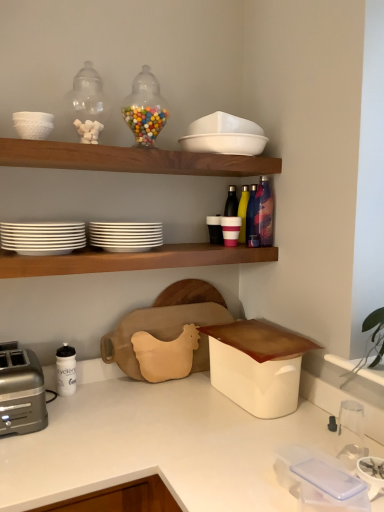
This screenshot has width=384, height=512. I want to click on white glossy plates at upper left, positioned as the second tableware in bottom-to-top order, so click(42, 237).

Locate an element on the screen. This screenshot has height=512, width=384. matte black cup at center, the third tableware positioned from the top is located at coordinates (215, 229).

This screenshot has height=512, width=384. I want to click on metallic multi-colored bottle at upper right, the 1th bottle viewed from the front, so click(x=264, y=213).

This screenshot has height=512, width=384. What are the coordinates of `white glossy plates at upper left, positioned as the second tableware in bottom-to-top order` in the screenshot? It's located at (42, 237).

Is point (251, 160) closer or farther from the camera than point (254, 232)?

Point (251, 160) is positioned closer to the camera compared to point (254, 232).

Is wooden shelf at upper center, acting as the first shelf starting from the top, inside the boundaries of metallic blue water bottle at upper right, the 2th bottle when ordered from back to front, or outside?

wooden shelf at upper center, acting as the first shelf starting from the top, cannot be found inside metallic blue water bottle at upper right, the 2th bottle when ordered from back to front.

Is the depth of wooden shelf at upper center, acting as the first shelf starting from the top, greater than that of metallic blue water bottle at upper right, the second bottle in the front-to-back sequence?

No, wooden shelf at upper center, acting as the first shelf starting from the top, is closer to the camera.

From a real-world perspective, does white glossy plates at upper left, positioned as the second tableware in bottom-to-top order, sit lower than metallic multi-colored bottle at upper right, the 1th bottle viewed from the front?

Correct, in the physical world, white glossy plates at upper left, positioned as the second tableware in bottom-to-top order, is lower than metallic multi-colored bottle at upper right, the 1th bottle viewed from the front.

Is metallic multi-colored bottle at upper right, the 1th bottle viewed from the front, at the back of white glossy plates at upper left, positioned as the second tableware in bottom-to-top order?

No.

Is white glossy plates at upper left, the 6th tableware from the top, smaller than metallic multi-colored bottle at upper right, arranged as the third bottle when viewed from the back?

Actually, white glossy plates at upper left, the 6th tableware from the top, might be larger than metallic multi-colored bottle at upper right, arranged as the third bottle when viewed from the back.

Considering the positions of point (74, 222) and point (256, 223), is point (74, 222) closer or farther from the camera than point (256, 223)?

Point (74, 222) appears to be closer to the viewer than point (256, 223).

From the image's perspective, relative to matte black cup at center, the 5th tableware in the bottom-to-top sequence, is metallic multi-colored bottle at upper right, arranged as the third bottle when viewed from the back, above or below?

Clearly, from the image's perspective, metallic multi-colored bottle at upper right, arranged as the third bottle when viewed from the back, is above matte black cup at center, the 5th tableware in the bottom-to-top sequence.

How many degrees apart are the facing directions of metallic multi-colored bottle at upper right, the 1th bottle viewed from the front, and matte black cup at center, the third tableware positioned from the top?

0.00116 degrees.

Is metallic multi-colored bottle at upper right, arranged as the third bottle when viewed from the back, facing towards matte black cup at center, the third tableware positioned from the top?

No.

Is metallic multi-colored bottle at upper right, the 1th bottle viewed from the front, to the left of matte black cup at center, the third tableware positioned from the top, from the viewer's perspective?

Incorrect, metallic multi-colored bottle at upper right, the 1th bottle viewed from the front, is not on the left side of matte black cup at center, the third tableware positioned from the top.

From a real-world perspective, who is located lower, white matte plates at center, the 2th shelf from the top, or white matte cup at center, the fourth tableware positioned from the bottom?

In real-world perspective, white matte plates at center, the 2th shelf from the top, is lower.

Between white matte plates at center, the first shelf ordered from the bottom, and white matte cup at center, which appears as the fourth tableware when viewed from the top, which one has smaller size?

With smaller size is white matte cup at center, which appears as the fourth tableware when viewed from the top.

Identify the location of shelf that is the 1st one when counting leftward from the white matte cup at center, which appears as the fourth tableware when viewed from the top. The width and height of the screenshot is (384, 512). (132, 259).

Which is in front, white matte plates at center, the 2th shelf from the top, or white matte cup at center, which appears as the fourth tableware when viewed from the top?

white matte plates at center, the 2th shelf from the top, is closer to the camera.

Consider the image. From the image's perspective, relative to wooden shelf at upper center, the second shelf when ordered from bottom to top, is yellow matte bottle at upper right, which ranks as the third bottle in front-to-back order, above or below?

Clearly, from the image's perspective, yellow matte bottle at upper right, which ranks as the third bottle in front-to-back order, is below wooden shelf at upper center, the second shelf when ordered from bottom to top.

From a real-world perspective, which object stands above the other?

In real-world perspective, wooden shelf at upper center, the second shelf when ordered from bottom to top, is above.

Which of these two, yellow matte bottle at upper right, which ranks as the third bottle in front-to-back order, or wooden shelf at upper center, the second shelf when ordered from bottom to top, is wider?

A: wooden shelf at upper center, the second shelf when ordered from bottom to top.

Is point (61, 371) positioned after point (195, 247)?

No, it is not.

Which object is wider, white matte water bottle at left, placed as the 1th tableware when sorted from bottom to top, or white matte plates at center, the first shelf ordered from the bottom?

Wider between the two is white matte plates at center, the first shelf ordered from the bottom.

In the scene shown: From the image's perspective, is white matte water bottle at left, which ranks as the 7th tableware in top-to-bottom order, on top of white matte plates at center, the 2th shelf from the top?

No.

Is white matte water bottle at left, placed as the 1th tableware when sorted from bottom to top, situated inside white matte plates at center, the 2th shelf from the top, or outside?

white matte water bottle at left, placed as the 1th tableware when sorted from bottom to top, is spatially situated outside white matte plates at center, the 2th shelf from the top.

Looking at their sizes, would you say metallic multi-colored bottle at upper right, the 1th bottle viewed from the front, is wider or thinner than white matte cup at center, the fourth tableware positioned from the bottom?

metallic multi-colored bottle at upper right, the 1th bottle viewed from the front, is wider than white matte cup at center, the fourth tableware positioned from the bottom.

Which is closer to the camera, (256, 212) or (236, 229)?

Point (256, 212) is closer to the camera than point (236, 229).

Considering their positions, is metallic multi-colored bottle at upper right, arranged as the third bottle when viewed from the back, located in front of or behind white matte cup at center, the fourth tableware positioned from the bottom?

Visually, metallic multi-colored bottle at upper right, arranged as the third bottle when viewed from the back, is located in front of white matte cup at center, the fourth tableware positioned from the bottom.

Locate an element on the screen. The height and width of the screenshot is (512, 384). shelf above the metallic blue water bottle at upper right, the 2th bottle when ordered from back to front (from the image's perspective) is located at coordinates (131, 159).

Which tableware is the 5th one when counting from the front of the metallic multi-colored bottle at upper right, the 1th bottle viewed from the front? Please provide its 2D coordinates.

[(42, 237)]

Estimate the real-world distances between objects in this image. Which object is further from white matte bowl at upper left, the 2th tableware positioned from the top, white matte water bottle at left, which ranks as the 7th tableware in top-to-bottom order, or translucent glass jar at upper center, which is the seventh tableware in bottom-to-top order?

white matte water bottle at left, which ranks as the 7th tableware in top-to-bottom order, is positioned further to the anchor white matte bowl at upper left, the 2th tableware positioned from the top.

Which object lies further to the anchor point metallic blue water bottle at upper right, the second bottle in the front-to-back sequence, matte black cup at center, the third tableware positioned from the top, or wooden shelf at upper center, the second shelf when ordered from bottom to top?

The object further to metallic blue water bottle at upper right, the second bottle in the front-to-back sequence, is wooden shelf at upper center, the second shelf when ordered from bottom to top.

Considering their positions, is silver metallic toaster at lower left positioned closer to white matte plates at center, the first shelf ordered from the bottom, than metallic blue water bottle at upper right, the second bottle in the front-to-back sequence?

metallic blue water bottle at upper right, the second bottle in the front-to-back sequence, lies closer to white matte plates at center, the first shelf ordered from the bottom, than the other object.

From the image, which object appears to be nearer to metallic blue water bottle at upper right, the 2th bottle when ordered from back to front, white matte countertop at lower right or white glossy plates at upper center, which is the third tableware from bottom to top?

The object closer to metallic blue water bottle at upper right, the 2th bottle when ordered from back to front, is white glossy plates at upper center, which is the third tableware from bottom to top.

Considering their positions, is white glossy plates at upper left, positioned as the second tableware in bottom-to-top order, positioned further to matte black cup at center, the third tableware positioned from the top, than white glossy plates at upper center, which is the third tableware from bottom to top?

white glossy plates at upper left, positioned as the second tableware in bottom-to-top order.

Looking at the image, which one is located further to matte black cup at center, the 5th tableware in the bottom-to-top sequence, silver metallic toaster at lower left or white matte bowl at upper left, placed as the 6th tableware when sorted from bottom to top?

Among the two, silver metallic toaster at lower left is located further to matte black cup at center, the 5th tableware in the bottom-to-top sequence.

Which object lies further to the anchor point matte black cup at center, the third tableware positioned from the top, silver metallic toaster at lower left or yellow matte bottle at upper right, which ranks as the third bottle in front-to-back order?

silver metallic toaster at lower left is further to matte black cup at center, the third tableware positioned from the top.

Based on their spatial positions, is metallic blue water bottle at upper right, the 2th bottle when ordered from back to front, or matte black cup at center, the third tableware positioned from the top, further from white matte bowl at upper left, the 2th tableware positioned from the top?

Among the two, metallic blue water bottle at upper right, the 2th bottle when ordered from back to front, is located further to white matte bowl at upper left, the 2th tableware positioned from the top.

You are a GUI agent. You are given a task and a screenshot of the screen. Output one action in this format:
    pyautogui.click(x=<x>, y=<y>)
    Task: Click on the plant that lies between metallic multi-colored bottle at upper right, the 1th bottle viewed from the front, and white plastic container at lower right from top to bottom
    This screenshot has width=384, height=512.
    Given the screenshot: What is the action you would take?
    pyautogui.click(x=372, y=341)

At what (x,y) coordinates should I click in order to perform the action: click on appliance located between white glossy plates at upper left, positioned as the second tableware in bottom-to-top order, and green leafy plant at upper right in the left-right direction. Please return your answer as a coordinate pair (x, y). Looking at the image, I should click on (257, 365).

The height and width of the screenshot is (512, 384). Identify the location of plant that lies between white matte bowl at upper left, placed as the 6th tableware when sorted from bottom to top, and white matte countertop at lower right from top to bottom. (372, 341).

Identify the location of bottle positioned between white matte cup at center, the fourth tableware positioned from the bottom, and yellow matte bottle at upper right, which ranks as the third bottle in front-to-back order, from near to far. This screenshot has height=512, width=384. (250, 213).